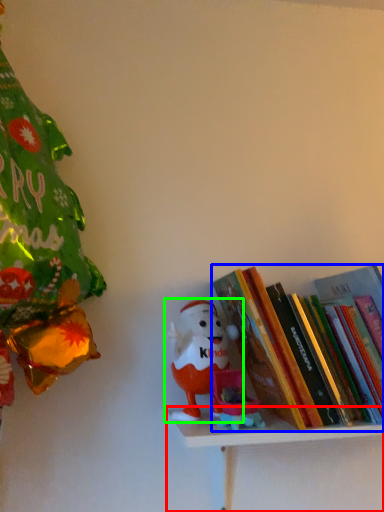
Question: Which object is the closest to the shelf (highlighted by a red box)? Choose among these: book (highlighted by a blue box) or toy (highlighted by a green box).

Choices:
 (A) book
 (B) toy

Answer: (B)